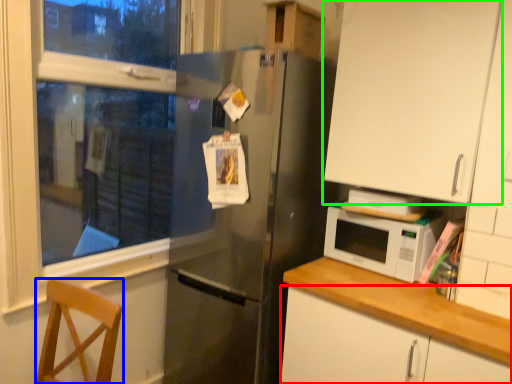
Question: Which is farther away from cabinetry (highlighted by a red box)? chair (highlighted by a blue box) or cabinetry (highlighted by a green box)?

Choices:
 (A) chair
 (B) cabinetry

Answer: (A)